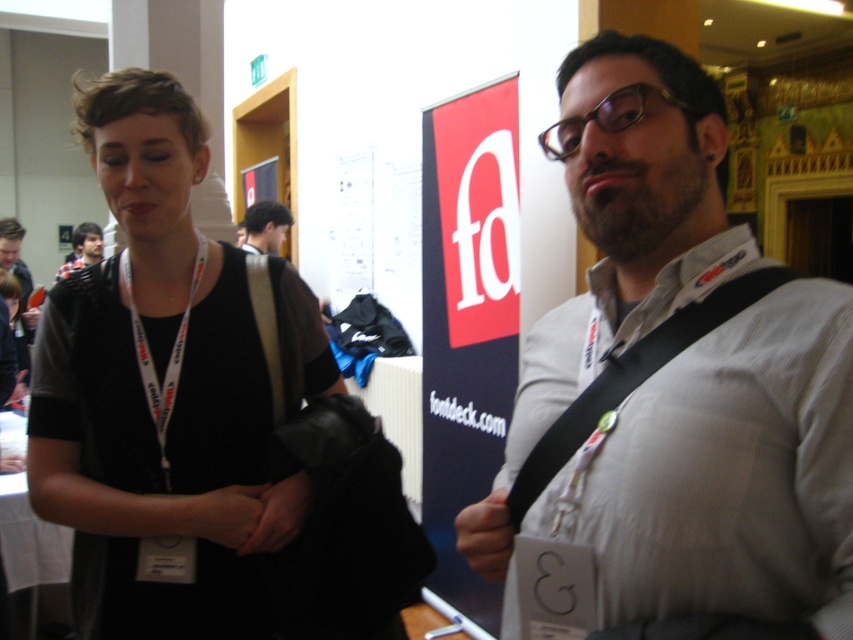
Looking at this image, you are organizing a conference and need to ensure that the lanyards are visible against the attendees shirts. Given the white fabric lanyard at center and dark blue shirt at upper left, which object has a smaller width and why?

The white fabric lanyard at center has a smaller width than the dark blue shirt at upper left because the description states that the lanyard at center is less in width compared to the dark blue shirt at upper left.

You are an event organizer who needs to ensure that all attendees have their badges visible. You notice two people in the image. The first person has a white fabric lanyard at center and the second has dark brown hair at upper center. Which object is taller in the image?

The white fabric lanyard at center is taller than the dark brown hair at upper center.

You are at a networking event and need to identify the person with the white fabric lanyard at center. Where should you look relative to their dark brown hair at upper center?

The white fabric lanyard at center is located below the dark brown hair at upper center, so you should look downward from the dark brown hair at upper center to find the white fabric lanyard at center.